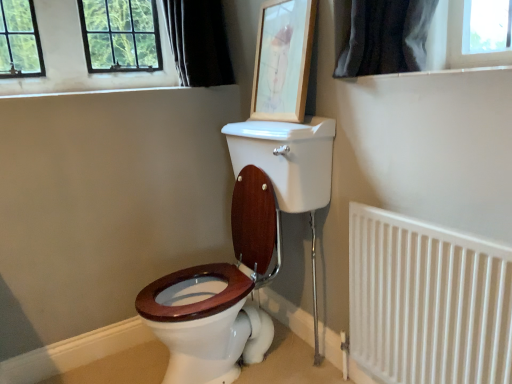
At what (x,y) coordinates should I click in order to perform the action: click on wooden picture frame at upper center. Please return your answer as a coordinate pair (x, y). Looking at the image, I should click on (283, 60).

The width and height of the screenshot is (512, 384). Identify the location of wooden picture frame at upper center. (283, 60).

From a real-world perspective, between wooden picture frame at upper center and white metal radiator at lower right, who is vertically higher?

wooden picture frame at upper center, from a real-world perspective.

Does wooden picture frame at upper center turn towards white metal radiator at lower right?

No, wooden picture frame at upper center is not oriented towards white metal radiator at lower right.

Consider the image. In the image, is wooden picture frame at upper center positioned in front of or behind white metal radiator at lower right?

wooden picture frame at upper center is positioned farther from the viewer than white metal radiator at lower right.

From a real-world perspective, is black fabric curtain at upper left positioned over white metal radiator at lower right based on gravity?

Yes.

From the picture: From the image's perspective, is black fabric curtain at upper left beneath white metal radiator at lower right?

Incorrect, from the image's perspective, black fabric curtain at upper left is higher than white metal radiator at lower right.

Could white metal radiator at lower right be considered to be inside black fabric curtain at upper left?

No, white metal radiator at lower right is not a part of black fabric curtain at upper left.

Find the location of a particular element. curtain above the white metal radiator at lower right (from a real-world perspective) is located at coordinates (199, 42).

Considering the positions of point (302, 57) and point (199, 0), is point (302, 57) closer or farther from the camera than point (199, 0)?

Clearly, point (302, 57) is closer to the camera than point (199, 0).

Is wooden picture frame at upper center oriented towards black fabric curtain at upper left?

No, wooden picture frame at upper center is not aimed at black fabric curtain at upper left.

Can you tell me how much wooden picture frame at upper center and black fabric curtain at upper left differ in facing direction?

The angle between the facing direction of wooden picture frame at upper center and the facing direction of black fabric curtain at upper left is 91.5 degrees.

Do you think wooden picture frame at upper center is within black fabric curtain at upper left, or outside of it?

wooden picture frame at upper center is not inside black fabric curtain at upper left, it's outside.

From the image's perspective, is white metal radiator at lower right beneath black fabric curtain at upper left?

Correct, white metal radiator at lower right appears lower than black fabric curtain at upper left in the image.

Is white metal radiator at lower right far away from black fabric curtain at upper left?

Absolutely, white metal radiator at lower right is distant from black fabric curtain at upper left.

Between white metal radiator at lower right and black fabric curtain at upper left, which one has larger width?

With larger width is black fabric curtain at upper left.

From a real-world perspective, between white metal radiator at lower right and wooden picture frame at upper center, who is vertically higher?

wooden picture frame at upper center is physically above.

Are white metal radiator at lower right and wooden picture frame at upper center making contact?

No, white metal radiator at lower right is not in contact with wooden picture frame at upper center.

Is white metal radiator at lower right taller or shorter than wooden picture frame at upper center?

Considering their sizes, white metal radiator at lower right has more height than wooden picture frame at upper center.

How different are the orientations of white metal radiator at lower right and wooden picture frame at upper center in degrees?

There is a 0.482-degree angle between the facing directions of white metal radiator at lower right and wooden picture frame at upper center.

From the image's perspective, relative to wooden picture frame at upper center, is black fabric curtain at upper left above or below?

From the image's perspective, black fabric curtain at upper left appears above wooden picture frame at upper center.

Locate an element on the screen. curtain on the left of wooden picture frame at upper center is located at coordinates (199, 42).

In the scene shown: Can you confirm if black fabric curtain at upper left is taller than wooden picture frame at upper center?

In fact, black fabric curtain at upper left may be shorter than wooden picture frame at upper center.

At what (x,y) coordinates should I click in order to perform the action: click on radiator below the wooden picture frame at upper center (from the image's perspective). Please return your answer as a coordinate pair (x, y). This screenshot has width=512, height=384. Looking at the image, I should click on (426, 301).

There is a white metal radiator at lower right. At what (x,y) coordinates should I click in order to perform the action: click on curtain above it (from a real-world perspective). Please return your answer as a coordinate pair (x, y). This screenshot has width=512, height=384. Looking at the image, I should click on (199, 42).

Looking at the image, which one is located further to black fabric curtain at upper left, white metal radiator at lower right or wooden picture frame at upper center?

white metal radiator at lower right.

Looking at the image, which one is located closer to wooden picture frame at upper center, white metal radiator at lower right or black fabric curtain at upper left?

black fabric curtain at upper left lies closer to wooden picture frame at upper center than the other object.

Looking at the image, which one is located further to white metal radiator at lower right, wooden picture frame at upper center or black fabric curtain at upper left?

black fabric curtain at upper left is positioned further to the anchor white metal radiator at lower right.

Consider the image. When comparing their distances from black fabric curtain at upper left, does wooden picture frame at upper center or white metal radiator at lower right seem closer?

The object closer to black fabric curtain at upper left is wooden picture frame at upper center.

Looking at the image, which one is located further to wooden picture frame at upper center, black fabric curtain at upper left or white metal radiator at lower right?

Based on the image, white metal radiator at lower right appears to be further to wooden picture frame at upper center.

Considering their positions, is black fabric curtain at upper left positioned closer to white metal radiator at lower right than wooden picture frame at upper center?

Among the two, wooden picture frame at upper center is located nearer to white metal radiator at lower right.

The width and height of the screenshot is (512, 384). Find the location of `picture frame between black fabric curtain at upper left and white metal radiator at lower right from top to bottom`. picture frame between black fabric curtain at upper left and white metal radiator at lower right from top to bottom is located at coordinates (283, 60).